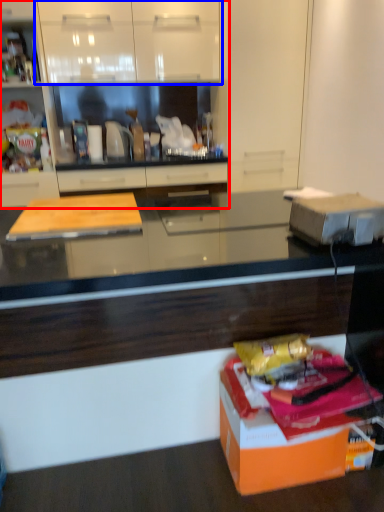
Question: Among these objects, which one is farthest to the camera, cabinetry (highlighted by a red box) or cabinetry (highlighted by a blue box)?

Choices:
 (A) cabinetry
 (B) cabinetry

Answer: (B)